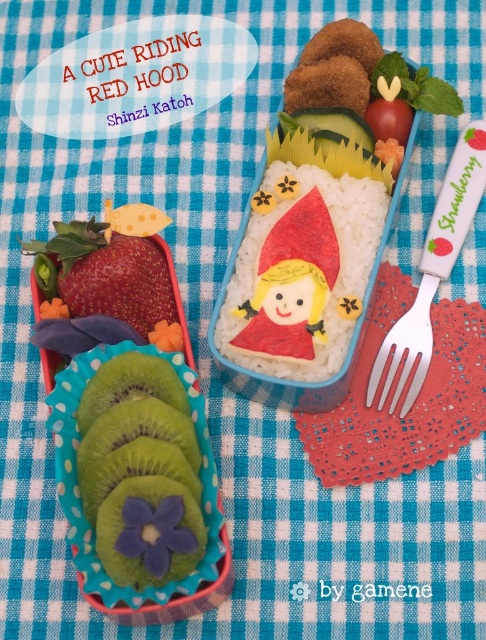
You are a food critic observing the bento box. The silver metallic fork at right and shiny red strawberry at left are part of the design. From your viewpoint, which object is closer to you?

The silver metallic fork at right is closer to you because the shiny red strawberry at left is behind it.

You are a food artist preparing a bento box. You have a white rice at center and a green textured kiwi at lower left. If you want to place a decorative cherry blossom between them, how far apart should you position the cherry blossom from each object?

The cherry blossom should be placed exactly halfway between the white rice at center and the green textured kiwi at lower left, which would be approximately 5.15 inches from each object since they are 10.30 inches apart.